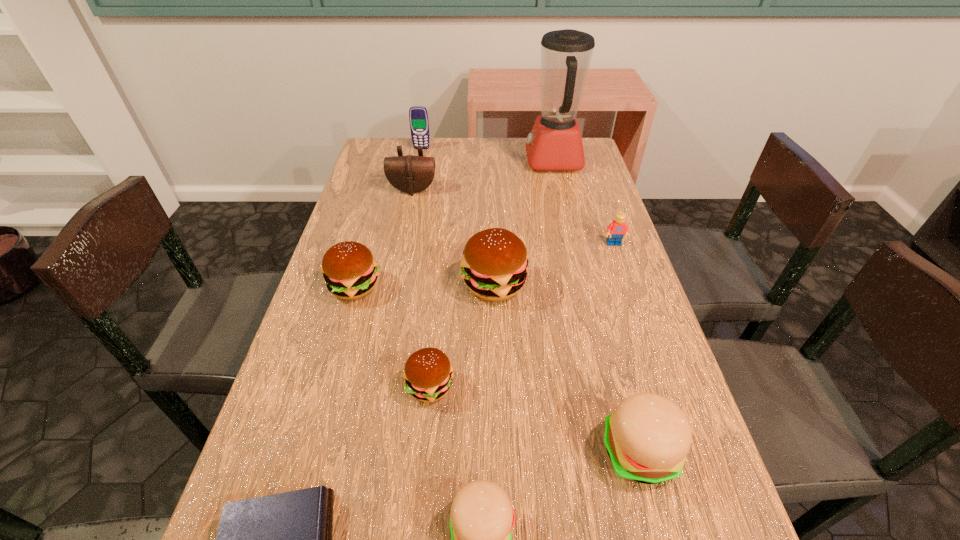
The width and height of the screenshot is (960, 540). Identify the location of unoccupied area between the biggest brown hamburger and the third farthest hamburger. (462, 335).

Locate an element on the screen. Image resolution: width=960 pixels, height=540 pixels. vacant space that's between the cellular telephone and the tallest object is located at coordinates (488, 155).

You are a GUI agent. You are given a task and a screenshot of the screen. Output one action in this format:
    pyautogui.click(x=<x>, y=<y>)
    Task: Click on the free spot between the fourth farthest object and the bigger beige hamburger
    
    Given the screenshot: What is the action you would take?
    pyautogui.click(x=627, y=348)

Identify the location of free spot between the rightmost hamburger and the fourth farthest object. (627, 348).

The width and height of the screenshot is (960, 540). I want to click on object that stands as the seventh closest to the blender, so click(647, 438).

The image size is (960, 540). I want to click on object that is the sixth closest one to the leftmost hamburger, so click(647, 438).

Where is `the closest hamburger relative to the second biggest brown hamburger`? The image size is (960, 540). the closest hamburger relative to the second biggest brown hamburger is located at coordinates (428, 374).

The image size is (960, 540). What are the coordinates of `the third closest hamburger relative to the left beige hamburger` in the screenshot? It's located at (494, 265).

Identify which brown hamburger is the second nearest to the blue book. Please provide its 2D coordinates. Your answer should be formatted as a tuple, i.e. [(x, y)], where the tuple contains the x and y coordinates of a point satisfying the conditions above.

[(350, 271)]

Select which brown hamburger is the second closest to the blender. Please provide its 2D coordinates. Your answer should be formatted as a tuple, i.e. [(x, y)], where the tuple contains the x and y coordinates of a point satisfying the conditions above.

[(350, 271)]